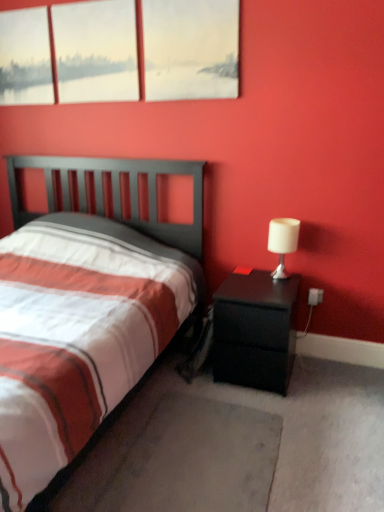
Where is `vacant region under gray carpet at lower center (from a real-world perspective)`? Image resolution: width=384 pixels, height=512 pixels. vacant region under gray carpet at lower center (from a real-world perspective) is located at coordinates (196, 464).